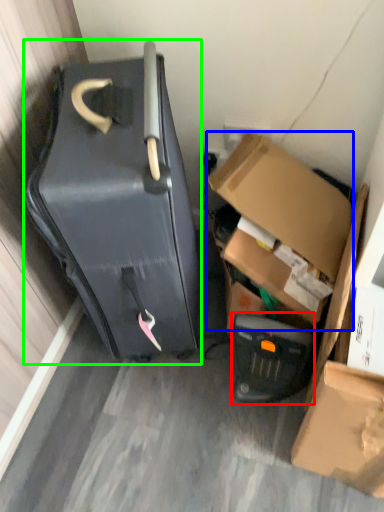
Question: Which is nearer to the appliance (highlighted by a red box)? box (highlighted by a blue box) or suitcase (highlighted by a green box).

Choices:
 (A) box
 (B) suitcase

Answer: (A)